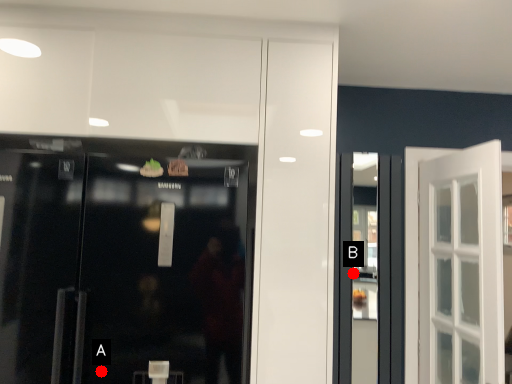
Question: Two points are circled on the image, labeled by A and B beside each circle. Which of the following is the farthest from the observer?

Choices:
 (A) A is further
 (B) B is further

Answer: (B)